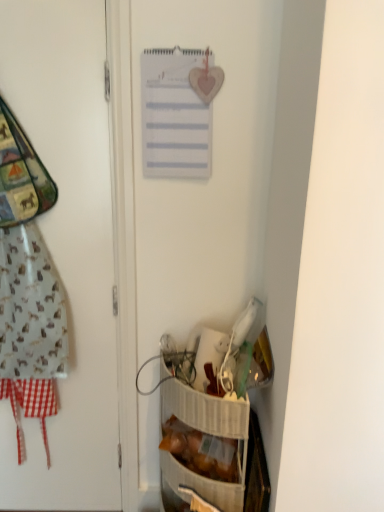
Question: Does point (165, 122) appear closer or farther from the camera than point (180, 455)?

Choices:
 (A) farther
 (B) closer

Answer: (B)

Question: Considering the positions of white paper calendar at upper center and translucent plastic bag of bread at lower right in the image, is white paper calendar at upper center bigger or smaller than translucent plastic bag of bread at lower right?

Choices:
 (A) small
 (B) big

Answer: (A)

Question: Which object is the closest to the white paper calendar at upper center?

Choices:
 (A) white matte door at left
 (B) translucent plastic bag of bread at lower right

Answer: (A)

Question: Based on their relative distances, which object is farther from the white matte door at left?

Choices:
 (A) translucent plastic bag of bread at lower right
 (B) white paper calendar at upper center

Answer: (A)